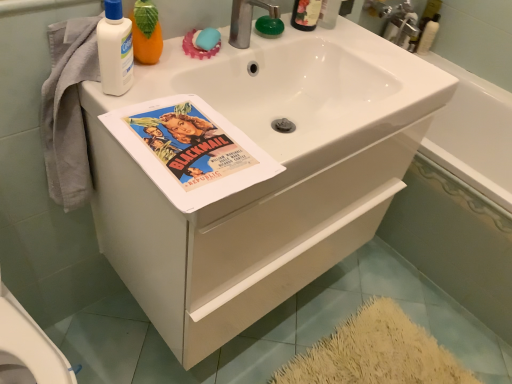
In order to click on free spot in front of white matte lotion at upper left, positioned as the 1th cleaning product in bottom-to-top order in this screenshot , I will do `click(136, 124)`.